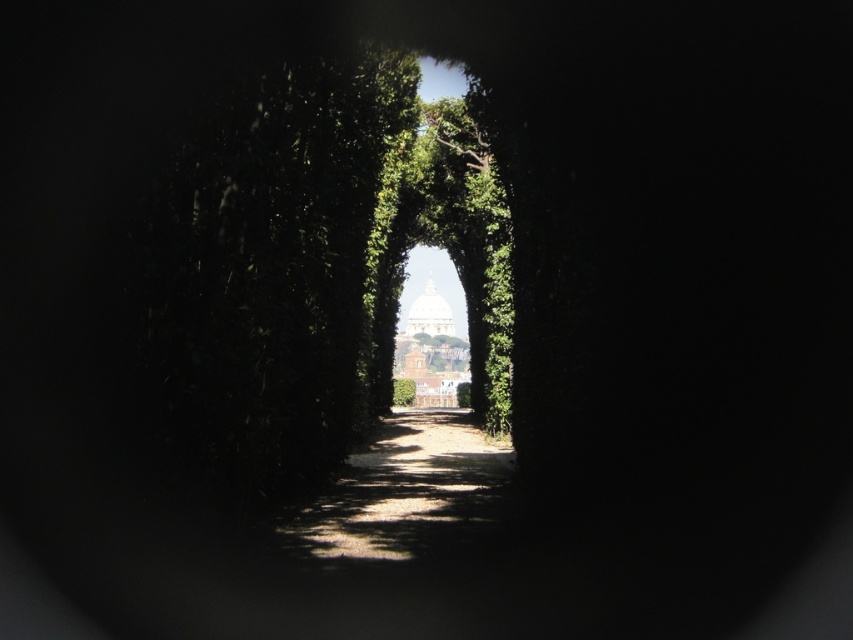
Who is taller, dirt path at center or green leafy hedge at center?

green leafy hedge at center is taller.

Who is shorter, dirt path at center or green leafy hedge at center?

dirt path at center

Does point (439, 506) lie in front of point (401, 381)?

Yes, point (439, 506) is closer to viewer.

You are a GUI agent. You are given a task and a screenshot of the screen. Output one action in this format:
    pyautogui.click(x=<x>, y=<y>)
    Task: Click on the dirt path at center
    
    Given the screenshot: What is the action you would take?
    pyautogui.click(x=407, y=493)